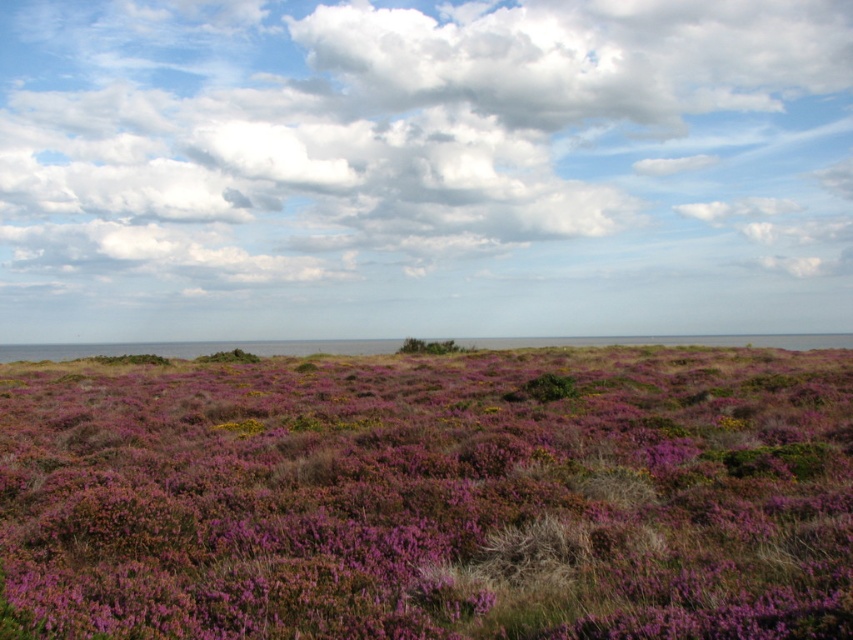
Question: Can you confirm if cloudy sky at upper center is positioned below purple grass at center?

Choices:
 (A) yes
 (B) no

Answer: (B)

Question: Which object appears farthest from the camera in this image?

Choices:
 (A) purple grass at center
 (B) cloudy sky at upper center

Answer: (B)

Question: Does cloudy sky at upper center appear under purple grass at center?

Choices:
 (A) yes
 (B) no

Answer: (B)

Question: Is cloudy sky at upper center positioned behind purple grass at center?

Choices:
 (A) no
 (B) yes

Answer: (B)